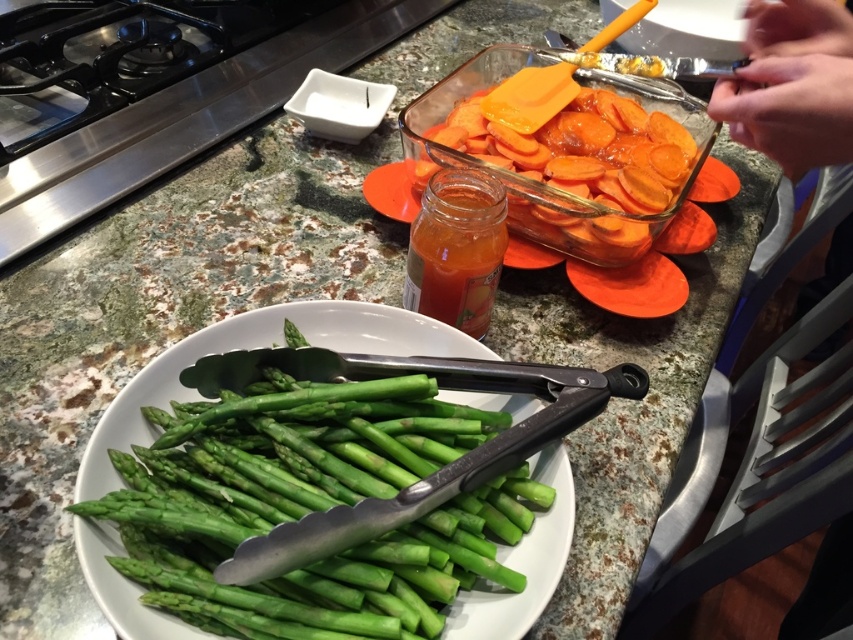
Question: Can you confirm if green matte asparagus at center is bigger than orange glazed carrots at center?

Choices:
 (A) yes
 (B) no

Answer: (B)

Question: Which object is farther from the camera taking this photo?

Choices:
 (A) smooth skin hands at upper right
 (B) orange glazed carrots at center
 (C) translucent glass jar at center
 (D) green matte asparagus at center

Answer: (B)

Question: Which point is closer to the camera taking this photo?

Choices:
 (A) (804, 72)
 (B) (546, 560)
 (C) (682, 188)
 (D) (459, 250)

Answer: (B)

Question: Is orange glazed carrots at center smaller than translucent glass jar at center?

Choices:
 (A) yes
 (B) no

Answer: (B)

Question: Is green matte asparagus at center below translucent glass jar at center?

Choices:
 (A) no
 (B) yes

Answer: (B)

Question: Which point is farther to the camera?

Choices:
 (A) (433, 193)
 (B) (751, 80)
 (C) (231, 330)

Answer: (A)